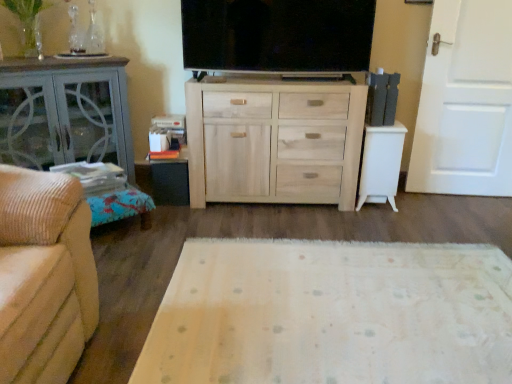
Image resolution: width=512 pixels, height=384 pixels. I want to click on vacant space underneath flat screen tv at center (from a real-world perspective), so click(295, 76).